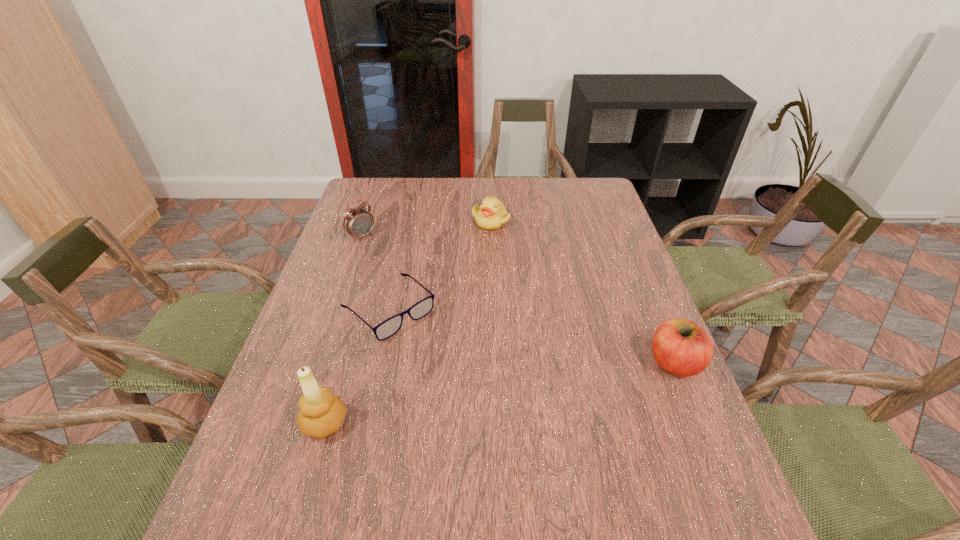
The width and height of the screenshot is (960, 540). I want to click on free space on the desktop that is between the nearest object and the apple and is positioned on the front-facing side of the shortest object, so click(x=481, y=396).

At what (x,y) coordinates should I click in order to perform the action: click on free space on the desktop that is between the candle_holder and the rightmost object and is positioned on the face of the alarm clock. Please return your answer as a coordinate pair (x, y). The width and height of the screenshot is (960, 540). Looking at the image, I should click on [x=549, y=384].

I want to click on free space on the desktop that is between the nearest object and the apple and is positioned at the face of the fourth tallest object, so click(x=460, y=400).